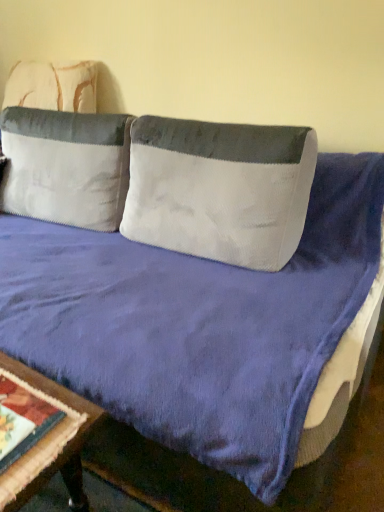
Question: From the image's perspective, is white textured pillow at center, arranged as the 1th pillow when viewed from the right, above or below white velvety pillow at upper left, which ranks as the 2th pillow in right-to-left order?

Choices:
 (A) above
 (B) below

Answer: (B)

Question: From a real-world perspective, relative to white velvety pillow at upper left, which is the 1th pillow from left to right, is white textured pillow at center, the 2th pillow when ordered from left to right, vertically above or below?

Choices:
 (A) above
 (B) below

Answer: (A)

Question: Which object is positioned closest to the wooden table at lower left?

Choices:
 (A) white textured pillow at center, arranged as the 1th pillow when viewed from the right
 (B) white velvety pillow at upper left, which is the 1th pillow from left to right

Answer: (A)

Question: Considering the real-world distances, which object is closest to the white velvety pillow at upper left, which is the 1th pillow from left to right?

Choices:
 (A) white textured pillow at center, the 2th pillow when ordered from left to right
 (B) wooden table at lower left

Answer: (A)